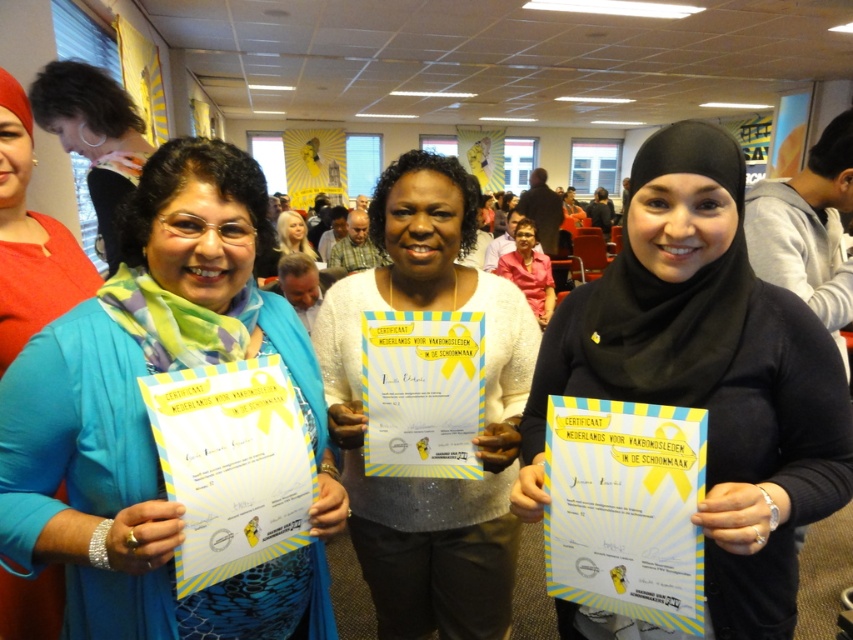
Question: Which object is positioned farthest from the matte black hijab at center?

Choices:
 (A) blue fabric scarf at left
 (B) blonde hair at center

Answer: (B)

Question: Which object is closer to the camera taking this photo?

Choices:
 (A) matte black hijab at center
 (B) matte red blouse at left
 (C) pink fabric shirt at center

Answer: (A)

Question: Can you confirm if blue fabric scarf at left is bigger than matte black hijab at center?

Choices:
 (A) yes
 (B) no

Answer: (B)

Question: Observing the image, what is the correct spatial positioning of blue fabric scarf at left in reference to pink fabric shirt at center?

Choices:
 (A) below
 (B) above

Answer: (A)

Question: Among these points, which one is nearest to the camera?

Choices:
 (A) (699, 339)
 (B) (517, 388)

Answer: (A)

Question: Where is white glittery sweater at center located in relation to pink fabric shirt at center in the image?

Choices:
 (A) left
 (B) right

Answer: (A)